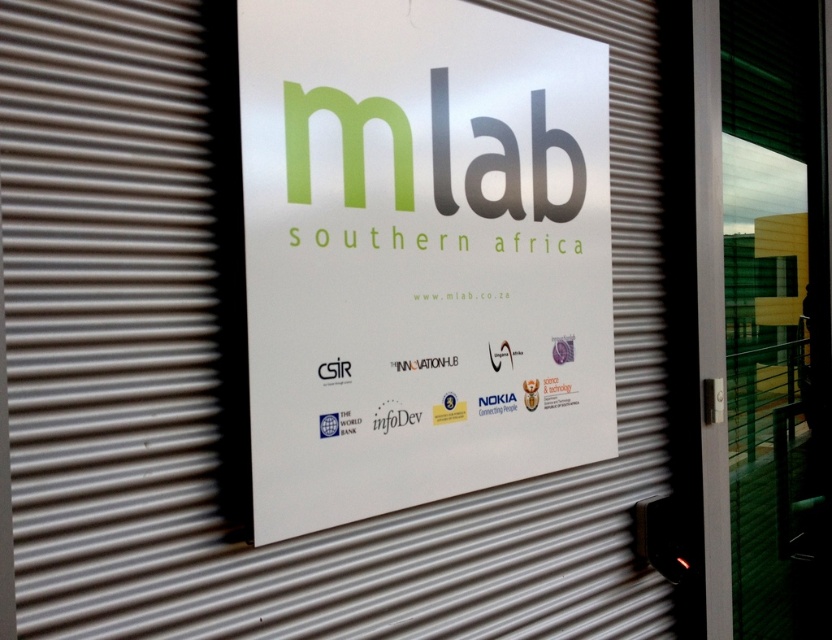
Who is higher up, white paper sign at center or transparent glass screen door at right?

white paper sign at center is above.

Does white paper sign at center have a smaller size compared to transparent glass screen door at right?

Yes, white paper sign at center is smaller than transparent glass screen door at right.

At what (x,y) coordinates should I click in order to perform the action: click on white paper sign at center. Please return your answer as a coordinate pair (x, y). The width and height of the screenshot is (832, 640). Looking at the image, I should click on (419, 253).